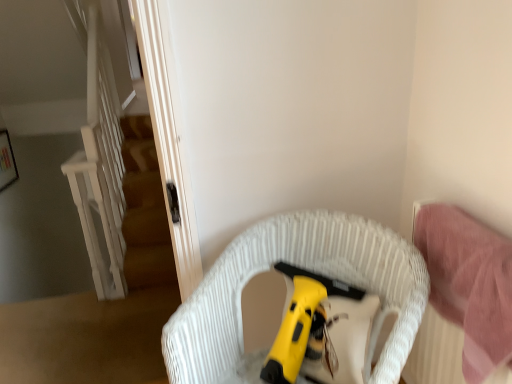
Question: From the image's perspective, does white woven chair at center appear lower than pink fabric bed at right?

Choices:
 (A) no
 (B) yes

Answer: (B)

Question: Does white woven chair at center have a larger size compared to pink fabric bed at right?

Choices:
 (A) yes
 (B) no

Answer: (A)

Question: Is pink fabric bed at right completely or partially inside white woven chair at center?

Choices:
 (A) no
 (B) yes

Answer: (A)

Question: Does white woven chair at center turn towards pink fabric bed at right?

Choices:
 (A) yes
 (B) no

Answer: (B)

Question: Is the position of white woven chair at center less distant than that of pink fabric bed at right?

Choices:
 (A) no
 (B) yes

Answer: (B)

Question: From the image's perspective, is yellow plastic vacuum cleaner at center positioned above or below pink fabric bed at right?

Choices:
 (A) below
 (B) above

Answer: (A)

Question: Relative to pink fabric bed at right, is yellow plastic vacuum cleaner at center in front or behind?

Choices:
 (A) behind
 (B) front

Answer: (A)

Question: Would you say yellow plastic vacuum cleaner at center is to the left or to the right of pink fabric bed at right in the picture?

Choices:
 (A) left
 (B) right

Answer: (A)

Question: Considering the positions of yellow plastic vacuum cleaner at center and pink fabric bed at right in the image, is yellow plastic vacuum cleaner at center taller or shorter than pink fabric bed at right?

Choices:
 (A) tall
 (B) short

Answer: (B)

Question: In the image, is white woven chair at center on the left side or the right side of pink fabric bed at right?

Choices:
 (A) left
 (B) right

Answer: (A)

Question: In terms of width, does white woven chair at center look wider or thinner when compared to pink fabric bed at right?

Choices:
 (A) wide
 (B) thin

Answer: (A)

Question: From a real-world perspective, relative to pink fabric bed at right, is white woven chair at center vertically above or below?

Choices:
 (A) above
 (B) below

Answer: (B)

Question: From the image's perspective, relative to pink fabric bed at right, is white woven chair at center above or below?

Choices:
 (A) below
 (B) above

Answer: (A)

Question: Looking at the image, does yellow plastic vacuum cleaner at center seem bigger or smaller compared to white woven chair at center?

Choices:
 (A) small
 (B) big

Answer: (A)

Question: From a real-world perspective, relative to white woven chair at center, is yellow plastic vacuum cleaner at center vertically above or below?

Choices:
 (A) below
 (B) above

Answer: (B)